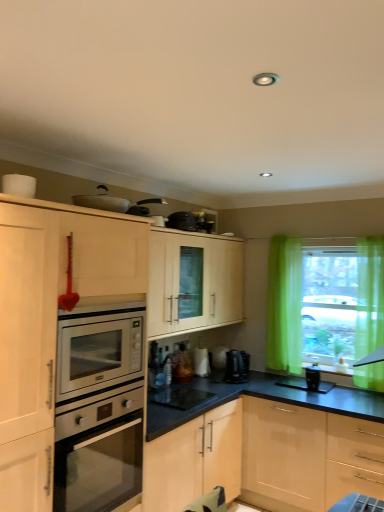
Question: Is black plastic coffee machine at center aimed at black glossy coffee maker at center, the third appliance positioned from the top?

Choices:
 (A) yes
 (B) no

Answer: (B)

Question: Is black plastic coffee machine at center completely or partially outside of black glossy coffee maker at center, which is the first appliance from bottom to top?

Choices:
 (A) no
 (B) yes

Answer: (B)

Question: From the image's perspective, is black plastic coffee machine at center on black glossy coffee maker at center, positioned as the second appliance in back-to-front order?

Choices:
 (A) no
 (B) yes

Answer: (B)

Question: Is black plastic coffee machine at center shorter than black glossy coffee maker at center, the second appliance positioned from the front?

Choices:
 (A) no
 (B) yes

Answer: (A)

Question: Does black plastic coffee machine at center come behind black glossy coffee maker at center, positioned as the second appliance in back-to-front order?

Choices:
 (A) no
 (B) yes

Answer: (B)

Question: From a real-world perspective, is black plastic coffee machine at center under black glossy coffee maker at center, arranged as the 2th appliance when viewed from the right?

Choices:
 (A) yes
 (B) no

Answer: (B)

Question: Considering the relative sizes of metallic silver pan at upper center, marked as the third appliance in a bottom-to-top arrangement, and green sheer curtains at right in the image provided, is metallic silver pan at upper center, marked as the third appliance in a bottom-to-top arrangement, wider than green sheer curtains at right?

Choices:
 (A) yes
 (B) no

Answer: (A)

Question: From the image's perspective, is metallic silver pan at upper center, which is the 1th appliance from left to right, located above green sheer curtains at right?

Choices:
 (A) no
 (B) yes

Answer: (B)

Question: Is metallic silver pan at upper center, positioned as the 3th appliance in back-to-front order, in front of green sheer curtains at right?

Choices:
 (A) no
 (B) yes

Answer: (B)

Question: From a real-world perspective, is metallic silver pan at upper center, marked as the third appliance in a bottom-to-top arrangement, beneath green sheer curtains at right?

Choices:
 (A) no
 (B) yes

Answer: (A)

Question: Is green sheer curtains at right at the back of metallic silver pan at upper center, the 1th appliance from the top?

Choices:
 (A) no
 (B) yes

Answer: (A)

Question: Is metallic silver pan at upper center, which is the 1th appliance from left to right, at the left side of green sheer curtains at right?

Choices:
 (A) no
 (B) yes

Answer: (B)

Question: Considering the relative positions of translucent glass window sill at lower right and silver metallic oven at left in the image provided, is translucent glass window sill at lower right to the left of silver metallic oven at left from the viewer's perspective?

Choices:
 (A) no
 (B) yes

Answer: (A)